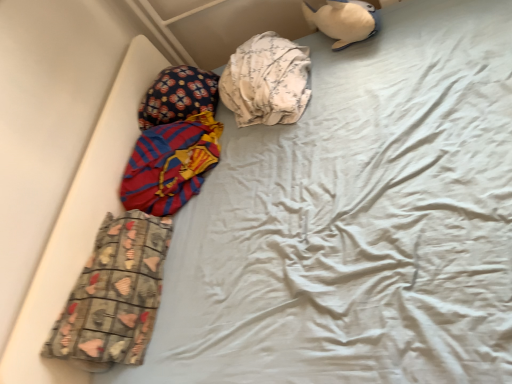
Identify the location of red and blue striped fabric at left, which ranks as the 2th material in bottom-to-top order. (170, 164).

Measure the distance between point (182, 110) and camera.

Point (182, 110) is 6.24 feet away from camera.

The height and width of the screenshot is (384, 512). Identify the location of white plush toy at upper right. (344, 21).

Image resolution: width=512 pixels, height=384 pixels. What do you see at coordinates (115, 295) in the screenshot?
I see `printed fabric pants at lower left, acting as the third material starting from the top` at bounding box center [115, 295].

Where is `red and blue striped fabric at left, the 2th material when ordered from top to bottom`? The image size is (512, 384). red and blue striped fabric at left, the 2th material when ordered from top to bottom is located at coordinates (170, 164).

Can you tell me how much white plush toy at upper right and white floral fabric at center, positioned as the third material in bottom-to-top order, differ in facing direction?

They differ by 4.64e-05 degrees in their facing directions.

Between white plush toy at upper right and white floral fabric at center, positioned as the third material in bottom-to-top order, which one has larger width?

white floral fabric at center, positioned as the third material in bottom-to-top order.

Does point (343, 10) come in front of point (254, 101)?

Yes, it is.

Can you confirm if white floral fabric at center, the 1th material in the top-to-bottom sequence, is positioned to the right of printed fabric pants at lower left, positioned as the 1th material in bottom-to-top order?

Yes, white floral fabric at center, the 1th material in the top-to-bottom sequence, is to the right of printed fabric pants at lower left, positioned as the 1th material in bottom-to-top order.

Is white floral fabric at center, positioned as the third material in bottom-to-top order, far away from printed fabric pants at lower left, positioned as the 1th material in bottom-to-top order?

No, white floral fabric at center, positioned as the third material in bottom-to-top order, is not far from printed fabric pants at lower left, positioned as the 1th material in bottom-to-top order.

Is white floral fabric at center, positioned as the third material in bottom-to-top order, inside or outside of printed fabric pants at lower left, acting as the third material starting from the top?

white floral fabric at center, positioned as the third material in bottom-to-top order, is spatially situated outside printed fabric pants at lower left, acting as the third material starting from the top.

Is white floral fabric at center, positioned as the third material in bottom-to-top order, aimed at printed fabric pants at lower left, positioned as the 1th material in bottom-to-top order?

No, white floral fabric at center, positioned as the third material in bottom-to-top order, is not oriented towards printed fabric pants at lower left, positioned as the 1th material in bottom-to-top order.

How different are the orientations of red and blue striped fabric at left, the 2th material when ordered from top to bottom, and printed fabric pants at lower left, positioned as the 1th material in bottom-to-top order, in degrees?

The facing directions of red and blue striped fabric at left, the 2th material when ordered from top to bottom, and printed fabric pants at lower left, positioned as the 1th material in bottom-to-top order, are 3.64e-05 degrees apart.

Is red and blue striped fabric at left, which ranks as the 2th material in bottom-to-top order, surrounding printed fabric pants at lower left, acting as the third material starting from the top?

No, printed fabric pants at lower left, acting as the third material starting from the top, is not inside red and blue striped fabric at left, which ranks as the 2th material in bottom-to-top order.

Does red and blue striped fabric at left, which ranks as the 2th material in bottom-to-top order, have a greater width compared to printed fabric pants at lower left, acting as the third material starting from the top?

Indeed, red and blue striped fabric at left, which ranks as the 2th material in bottom-to-top order, has a greater width compared to printed fabric pants at lower left, acting as the third material starting from the top.

Does red and blue striped fabric at left, the 2th material when ordered from top to bottom, have a larger size compared to printed fabric pants at lower left, positioned as the 1th material in bottom-to-top order?

Yes.

Between white floral fabric at center, the 1th material in the top-to-bottom sequence, and white plush toy at upper right, which one has larger width?

Wider between the two is white floral fabric at center, the 1th material in the top-to-bottom sequence.

Does white floral fabric at center, the 1th material in the top-to-bottom sequence, have a larger size compared to white plush toy at upper right?

Yes, white floral fabric at center, the 1th material in the top-to-bottom sequence, is bigger than white plush toy at upper right.

Between white floral fabric at center, positioned as the third material in bottom-to-top order, and white plush toy at upper right, which one has more height?

Standing taller between the two is white plush toy at upper right.

From a real-world perspective, which is physically below, white floral fabric at center, positioned as the third material in bottom-to-top order, or white plush toy at upper right?

In real-world perspective, white plush toy at upper right is lower.

Is printed fabric pants at lower left, acting as the third material starting from the top, completely or partially inside white plush toy at upper right?

That's incorrect, printed fabric pants at lower left, acting as the third material starting from the top, is not inside white plush toy at upper right.

How far apart are white plush toy at upper right and printed fabric pants at lower left, positioned as the 1th material in bottom-to-top order?

white plush toy at upper right and printed fabric pants at lower left, positioned as the 1th material in bottom-to-top order, are 4.01 feet apart.

Can you confirm if white plush toy at upper right is taller than printed fabric pants at lower left, positioned as the 1th material in bottom-to-top order?

Yes, white plush toy at upper right is taller than printed fabric pants at lower left, positioned as the 1th material in bottom-to-top order.

Are white plush toy at upper right and printed fabric pants at lower left, positioned as the 1th material in bottom-to-top order, located far from each other?

Absolutely, white plush toy at upper right is distant from printed fabric pants at lower left, positioned as the 1th material in bottom-to-top order.

Could you tell me if printed fabric pants at lower left, acting as the third material starting from the top, is facing white plush toy at upper right?

No, printed fabric pants at lower left, acting as the third material starting from the top, does not turn towards white plush toy at upper right.

Is printed fabric pants at lower left, acting as the third material starting from the top, shorter than white plush toy at upper right?

Yes, printed fabric pants at lower left, acting as the third material starting from the top, is shorter than white plush toy at upper right.

Considering the positions of objects printed fabric pants at lower left, positioned as the 1th material in bottom-to-top order, and white plush toy at upper right in the image provided, who is in front, printed fabric pants at lower left, positioned as the 1th material in bottom-to-top order, or white plush toy at upper right?

printed fabric pants at lower left, positioned as the 1th material in bottom-to-top order.

From a real-world perspective, which object stands above the other?

From a 3D spatial view, printed fabric pants at lower left, positioned as the 1th material in bottom-to-top order, is above.

Is red and blue striped fabric at left, the 2th material when ordered from top to bottom, far from white floral fabric at center, positioned as the third material in bottom-to-top order?

No, red and blue striped fabric at left, the 2th material when ordered from top to bottom, is not far away from white floral fabric at center, positioned as the third material in bottom-to-top order.

Choose the correct answer: Is red and blue striped fabric at left, the 2th material when ordered from top to bottom, inside white floral fabric at center, positioned as the third material in bottom-to-top order, or outside it?

red and blue striped fabric at left, the 2th material when ordered from top to bottom, is spatially situated outside white floral fabric at center, positioned as the third material in bottom-to-top order.

Which material is the 1st one when counting from the left side of the white floral fabric at center, the 1th material in the top-to-bottom sequence? Please provide its 2D coordinates.

[(170, 164)]

Which object is wider, red and blue striped fabric at left, which ranks as the 2th material in bottom-to-top order, or white floral fabric at center, the 1th material in the top-to-bottom sequence?

With larger width is white floral fabric at center, the 1th material in the top-to-bottom sequence.

Locate an element on the screen. the 1st material to the left of the white plush toy at upper right, starting your count from the anchor is located at coordinates (266, 81).

From the image's perspective, which material is the 2nd one above the printed fabric pants at lower left, positioned as the 1th material in bottom-to-top order? Please provide its 2D coordinates.

[(266, 81)]

Considering their positions, is fluffy fabric pillow at upper left positioned further to red and blue striped fabric at left, the 2th material when ordered from top to bottom, than printed fabric pants at lower left, acting as the third material starting from the top?

printed fabric pants at lower left, acting as the third material starting from the top, is further to red and blue striped fabric at left, the 2th material when ordered from top to bottom.

Looking at the image, which one is located closer to white floral fabric at center, the 1th material in the top-to-bottom sequence, white plush toy at upper right or fluffy fabric pillow at upper left?

fluffy fabric pillow at upper left.

Based on the photo, when comparing their distances from printed fabric pants at lower left, positioned as the 1th material in bottom-to-top order, does fluffy fabric pillow at upper left or white floral fabric at center, the 1th material in the top-to-bottom sequence, seem closer?

The object closer to printed fabric pants at lower left, positioned as the 1th material in bottom-to-top order, is fluffy fabric pillow at upper left.

Which object lies nearer to the anchor point white plush toy at upper right, red and blue striped fabric at left, the 2th material when ordered from top to bottom, or printed fabric pants at lower left, positioned as the 1th material in bottom-to-top order?

red and blue striped fabric at left, the 2th material when ordered from top to bottom.

Considering their positions, is fluffy fabric pillow at upper left positioned closer to printed fabric pants at lower left, positioned as the 1th material in bottom-to-top order, than white plush toy at upper right?

fluffy fabric pillow at upper left lies closer to printed fabric pants at lower left, positioned as the 1th material in bottom-to-top order, than the other object.

Considering their positions, is red and blue striped fabric at left, the 2th material when ordered from top to bottom, positioned closer to fluffy fabric pillow at upper left than white floral fabric at center, positioned as the third material in bottom-to-top order?

red and blue striped fabric at left, the 2th material when ordered from top to bottom, lies closer to fluffy fabric pillow at upper left than the other object.

Based on their spatial positions, is white plush toy at upper right or red and blue striped fabric at left, which ranks as the 2th material in bottom-to-top order, further from printed fabric pants at lower left, positioned as the 1th material in bottom-to-top order?

white plush toy at upper right.

Looking at the image, which one is located further to white plush toy at upper right, fluffy fabric pillow at upper left or red and blue striped fabric at left, the 2th material when ordered from top to bottom?

red and blue striped fabric at left, the 2th material when ordered from top to bottom, is positioned further to the anchor white plush toy at upper right.

You are a GUI agent. You are given a task and a screenshot of the screen. Output one action in this format:
    pyautogui.click(x=<x>, y=<y>)
    Task: Click on the material between fluffy fabric pillow at upper left and white floral fabric at center, the 1th material in the top-to-bottom sequence, in the horizontal direction
    The width and height of the screenshot is (512, 384).
    Given the screenshot: What is the action you would take?
    pyautogui.click(x=170, y=164)

This screenshot has height=384, width=512. Find the location of `pillow that lies between white floral fabric at center, the 1th material in the top-to-bottom sequence, and printed fabric pants at lower left, acting as the third material starting from the top, from top to bottom`. pillow that lies between white floral fabric at center, the 1th material in the top-to-bottom sequence, and printed fabric pants at lower left, acting as the third material starting from the top, from top to bottom is located at coordinates (178, 96).

You are a GUI agent. You are given a task and a screenshot of the screen. Output one action in this format:
    pyautogui.click(x=<x>, y=<y>)
    Task: Click on the material between red and blue striped fabric at left, the 2th material when ordered from top to bottom, and white plush toy at upper right from left to right
    
    Given the screenshot: What is the action you would take?
    pyautogui.click(x=266, y=81)

Where is `pillow that lies between white plush toy at upper right and printed fabric pants at lower left, positioned as the 1th material in bottom-to-top order, from top to bottom`? This screenshot has width=512, height=384. pillow that lies between white plush toy at upper right and printed fabric pants at lower left, positioned as the 1th material in bottom-to-top order, from top to bottom is located at coordinates (178, 96).